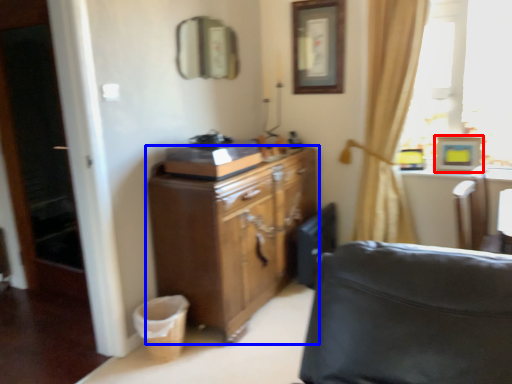
Question: Which object is further to the camera taking this photo, picture frame (highlighted by a red box) or cabinetry (highlighted by a blue box)?

Choices:
 (A) picture frame
 (B) cabinetry

Answer: (A)